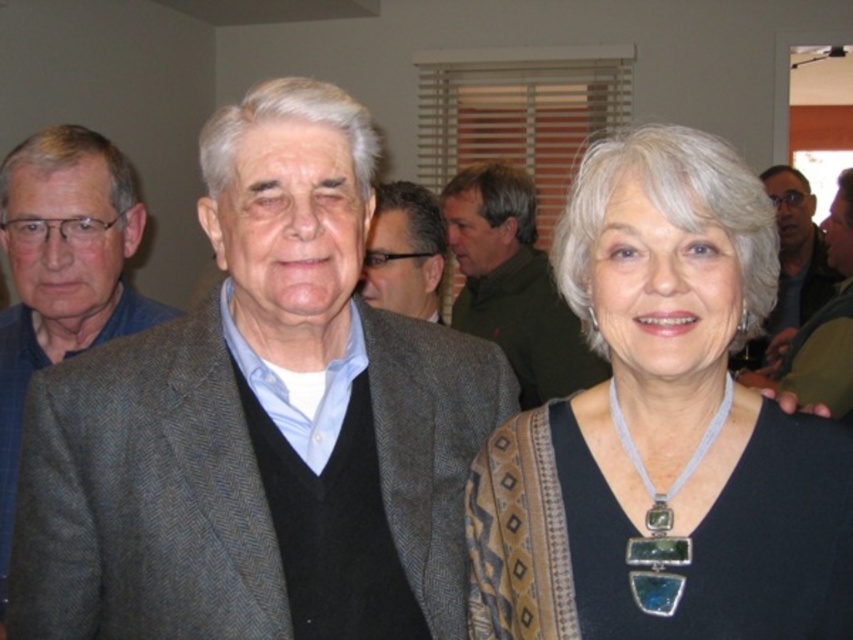
You are an interior designer assessing the color scheme of the room. The green wool sweater at center is placed at coordinates 0.444, 0.603. How does its placement affect the overall color harmony?

The placement of the green wool sweater at center at coordinates (514, 284) contributes to the color harmony by balancing the greenish hue of the woman necklace pendant with the other elements in the room.

You are a photographer at a social event. You need to position a 1.2 meter wide backdrop between the black fabric at center and the dark brown textured jacket at center. Can the backdrop fit between them?

The black fabric at center is 1.14 meters from the dark brown textured jacket at center. Since the backdrop is 1.2 meters wide, it cannot fit between them as the distance is slightly less than the backdrop width.